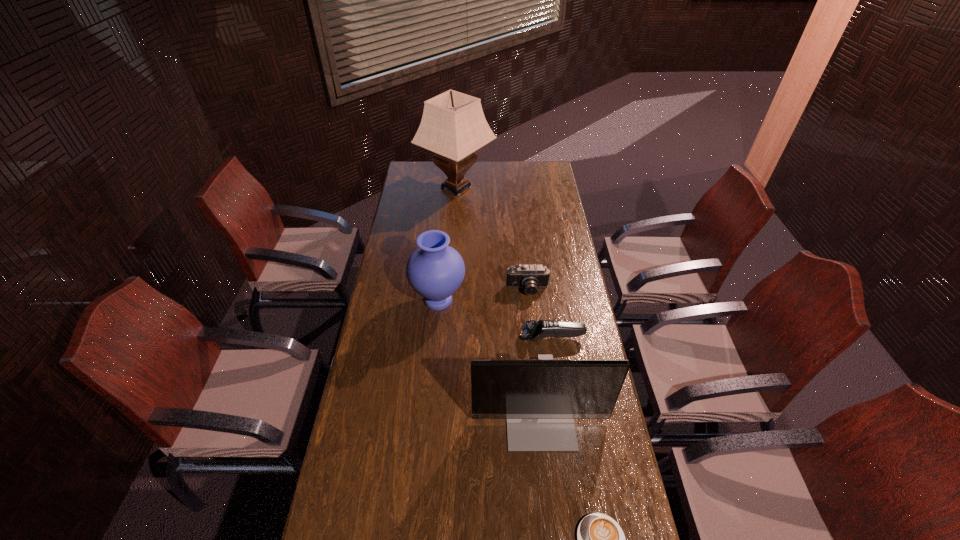
Locate an element on the screen. The image size is (960, 540). free spot located 0.060m on the front-facing side of the third shortest object is located at coordinates (530, 309).

Identify the location of vacant region located on the head of the fifth tallest object. The height and width of the screenshot is (540, 960). (481, 338).

The image size is (960, 540). I want to click on free space located on the head of the fifth tallest object, so click(446, 338).

Locate an element on the screen. This screenshot has height=540, width=960. vacant area situated 0.340m on the head of the fifth tallest object is located at coordinates (431, 338).

You are a GUI agent. You are given a task and a screenshot of the screen. Output one action in this format:
    pyautogui.click(x=<x>, y=<y>)
    Task: Click on the object that is at the far edge
    
    Given the screenshot: What is the action you would take?
    pyautogui.click(x=453, y=125)

Image resolution: width=960 pixels, height=540 pixels. Find the location of `lampshade at the left edge`. lampshade at the left edge is located at coordinates (453, 125).

What are the coordinates of `vase situated at the left edge` in the screenshot? It's located at (435, 270).

Identify the location of computer monitor that is at the right edge. (540, 399).

In order to click on camera that is positioned at the right edge in this screenshot , I will do `click(530, 277)`.

This screenshot has height=540, width=960. Identify the location of electric shaver present at the right edge. (532, 330).